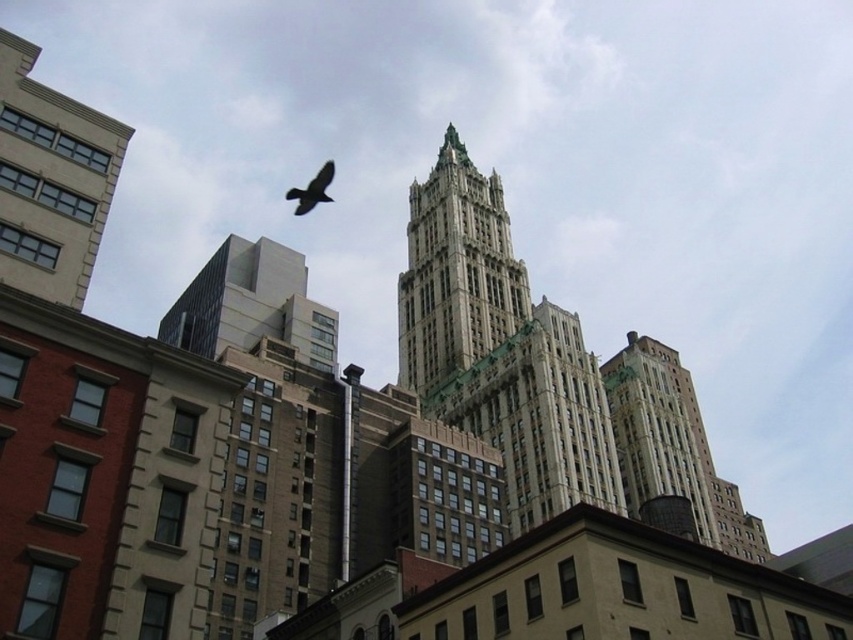
Does beige stone building at left have a lesser height compared to gray concrete building at upper left?

Correct, beige stone building at left is not as tall as gray concrete building at upper left.

You are a GUI agent. You are given a task and a screenshot of the screen. Output one action in this format:
    pyautogui.click(x=<x>, y=<y>)
    Task: Click on the beige stone building at left
    The width and height of the screenshot is (853, 640).
    Given the screenshot: What is the action you would take?
    pyautogui.click(x=51, y=179)

Find the location of a particular element. beige stone building at left is located at coordinates (51, 179).

Does beige stone building at left appear over gray stone tower at center?

No, beige stone building at left is not above gray stone tower at center.

Does point (10, 93) come in front of point (456, 157)?

Yes, point (10, 93) is in front of point (456, 157).

You are a GUI agent. You are given a task and a screenshot of the screen. Output one action in this format:
    pyautogui.click(x=<x>, y=<y>)
    Task: Click on the beige stone building at left
    
    Given the screenshot: What is the action you would take?
    pyautogui.click(x=51, y=179)

Can you confirm if beige stone building at left is bigger than shiny black bird at upper center?

No.

Find the location of a particular element. The image size is (853, 640). beige stone building at left is located at coordinates (51, 179).

Where is `beige stone building at left`? The height and width of the screenshot is (640, 853). beige stone building at left is located at coordinates (51, 179).